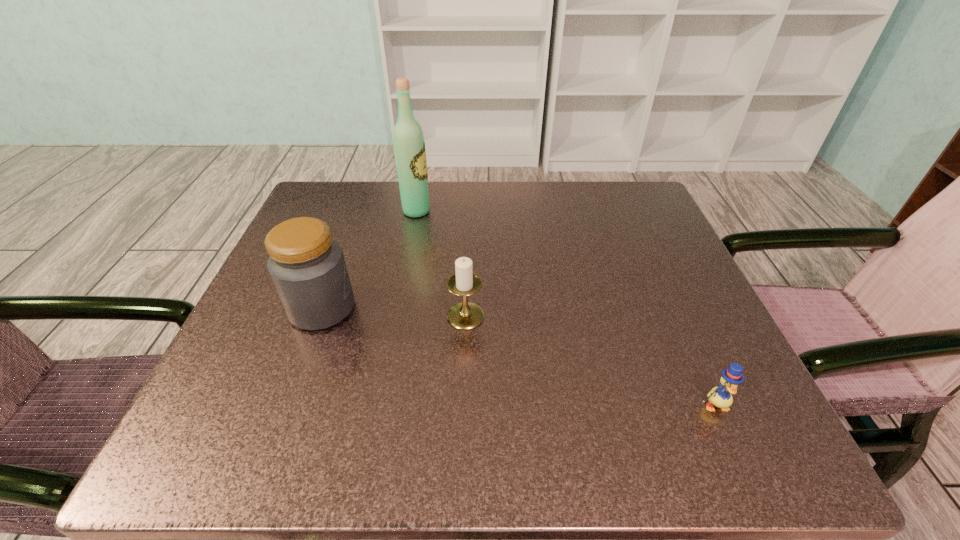
You are a GUI agent. You are given a task and a screenshot of the screen. Output one action in this format:
    pyautogui.click(x=<x>, y=<y>)
    Task: Click on the free space located on the left of the third tallest object
    The height and width of the screenshot is (540, 960).
    Given the screenshot: What is the action you would take?
    pyautogui.click(x=419, y=316)

Where is `object located in the far edge section of the desktop`? Image resolution: width=960 pixels, height=540 pixels. object located in the far edge section of the desktop is located at coordinates (409, 145).

At what (x,y) coordinates should I click in order to perform the action: click on object that is at the near edge. Please return your answer as a coordinate pair (x, y). Looking at the image, I should click on (721, 397).

The image size is (960, 540). What are the coordinates of `object at the left edge` in the screenshot? It's located at (307, 267).

The width and height of the screenshot is (960, 540). I want to click on object that is at the right edge, so click(721, 397).

Where is `object present at the near right corner`? This screenshot has width=960, height=540. object present at the near right corner is located at coordinates (721, 397).

Image resolution: width=960 pixels, height=540 pixels. In the image, there is a desktop. Find the location of `free space at the far edge`. free space at the far edge is located at coordinates (547, 181).

At what (x,y) coordinates should I click in order to perform the action: click on vacant space at the near edge of the desktop. Please return your answer as a coordinate pair (x, y). The width and height of the screenshot is (960, 540). Looking at the image, I should click on (479, 408).

This screenshot has width=960, height=540. I want to click on free space at the left edge, so click(273, 318).

Locate an element on the screen. The width and height of the screenshot is (960, 540). vacant space at the right edge is located at coordinates (703, 380).